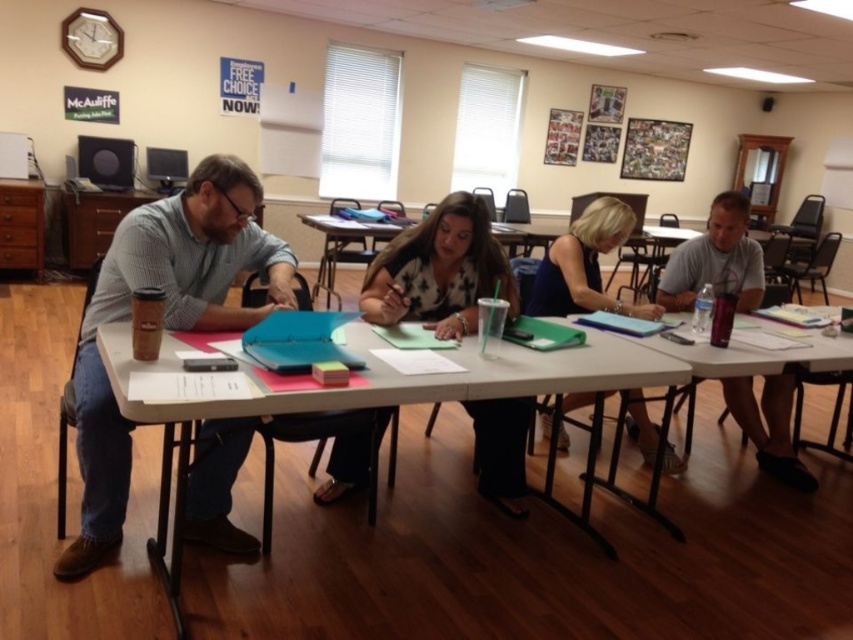
You are a person who needs to pass a pen from the matte gray shirt at left to the matte black woman at center. Given that the average human arm span is about 30 inches, can you reach them without moving from your current position?

The distance between the matte gray shirt at left and the matte black woman at center is 27.78 inches, which is less than the average human arm span of 30 inches. Therefore, you can reach them without moving.

You are a guest entering the room and want to sit down at the white plastic table at center. However, there is a blue fabric dress at center on the table. Can you sit there without moving the dress?

The white plastic table at center is wider than the blue fabric dress at center, so you can sit there without moving the dress as there is enough space.